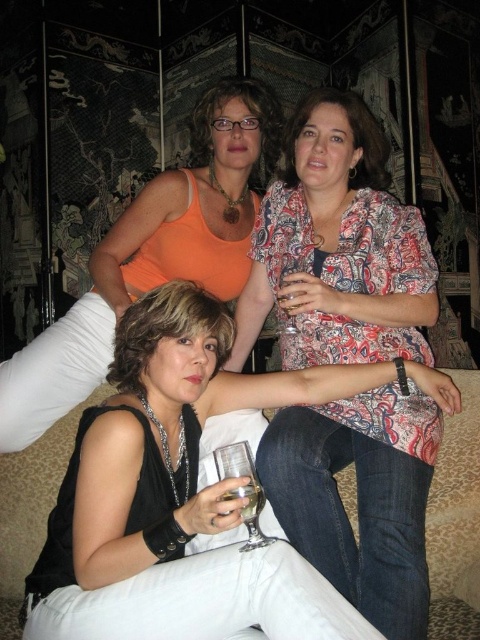
Question: Among these objects, which one is nearest to the camera?

Choices:
 (A) printed fabric blouse at center
 (B) clear glass at lower center

Answer: (B)

Question: Which point is farther to the camera?

Choices:
 (A) (365, 356)
 (B) (312, 637)
 (C) (120, 228)

Answer: (C)

Question: Is clear glass wine glass at lower center below clear glass wine glass at center?

Choices:
 (A) yes
 (B) no

Answer: (A)

Question: Does black leather jacket at center have a larger size compared to clear glass at lower center?

Choices:
 (A) yes
 (B) no

Answer: (A)

Question: Does printed fabric blouse at center appear on the right side of orange matte tank top at upper center?

Choices:
 (A) yes
 (B) no

Answer: (A)

Question: Which point appears farthest from the camera in this image?

Choices:
 (A) (352, 420)
 (B) (55, 365)
 (C) (220, 476)
 (D) (288, 310)

Answer: (B)